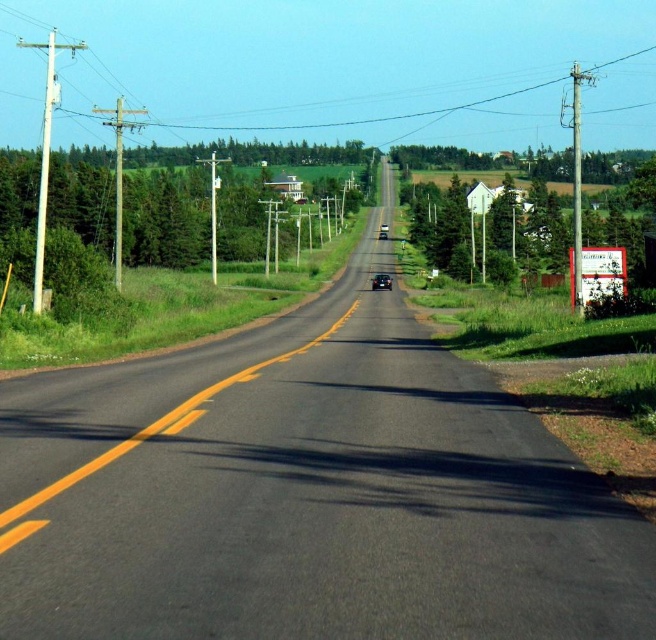
You are driving a car and see the green leafy tree at right and the shiny black car at center. Which object is taller?

The green leafy tree at right is much taller than the shiny black car at center.

You are driving a car and see the green leafy tree at right and the shiny black car at center. Which object is located to the right of the other?

The green leafy tree at right is positioned on the right side of the shiny black car at center.